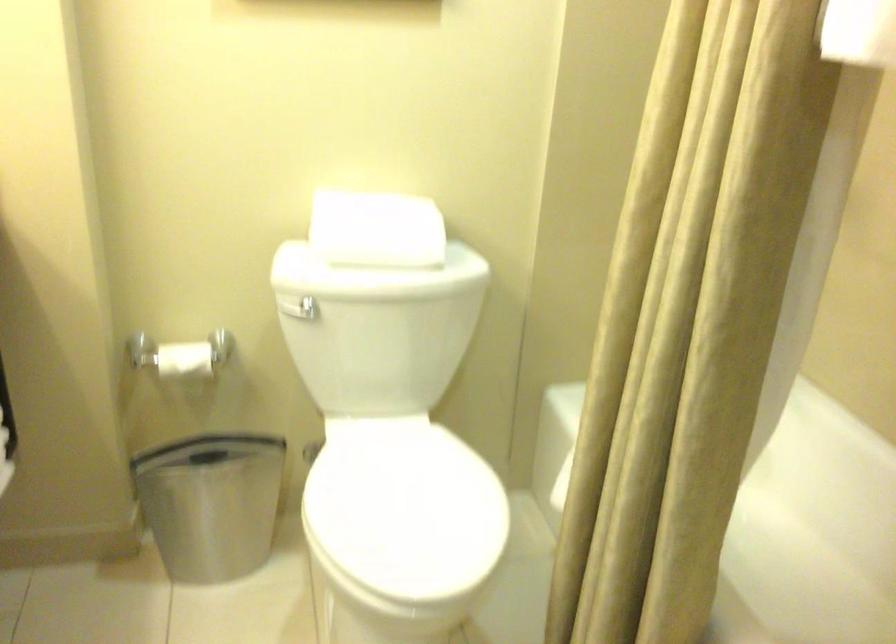
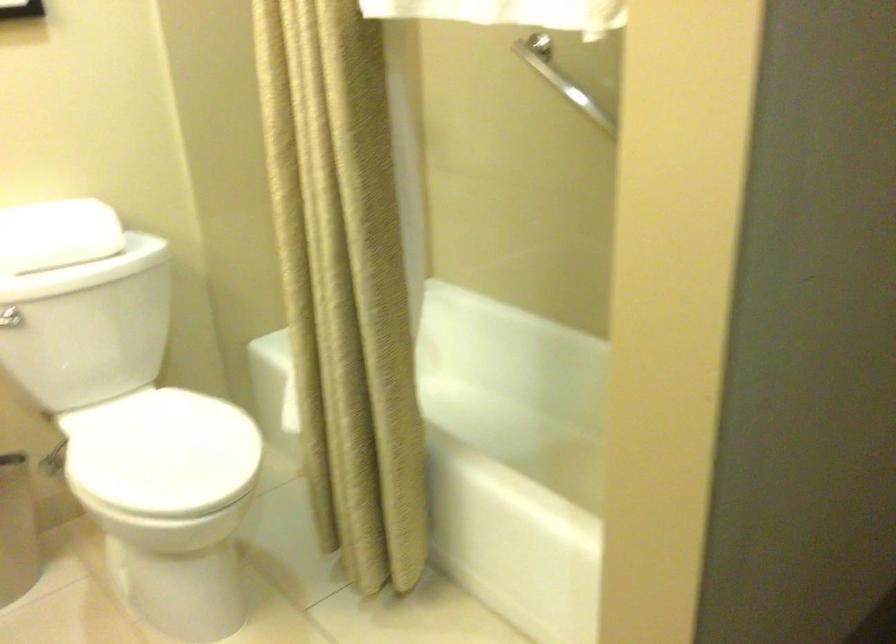
Where in the second image is the point corresponding to (x=398, y=504) from the first image?

(161, 453)